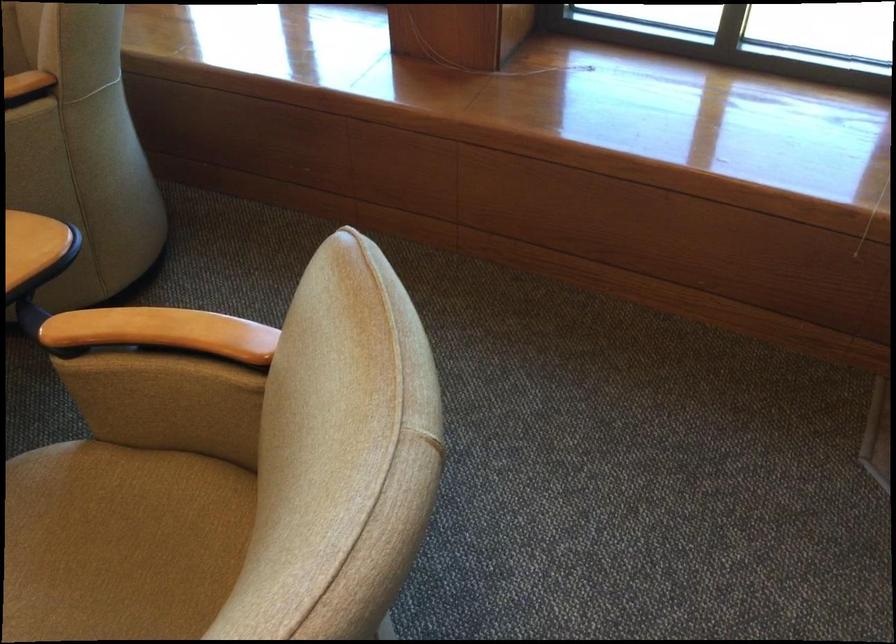
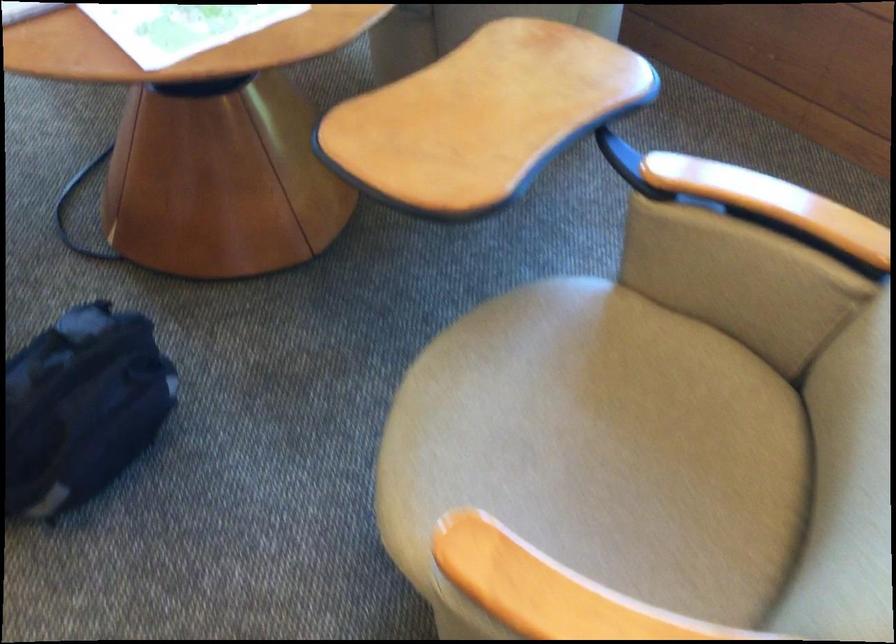
In the second image, find the point that corresponds to (164,334) in the first image.

(771, 202)